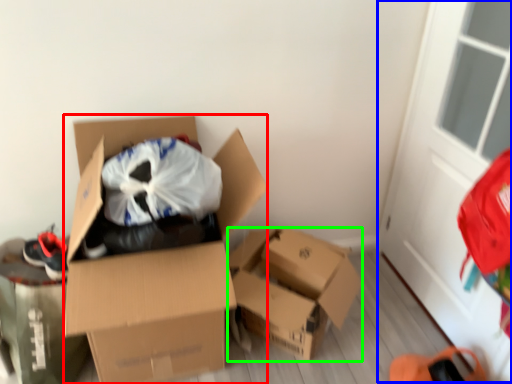
Question: Estimate the real-world distances between objects in this image. Which object is closer to box (highlighted by a red box), screen door (highlighted by a blue box) or box (highlighted by a green box)?

Choices:
 (A) screen door
 (B) box

Answer: (B)